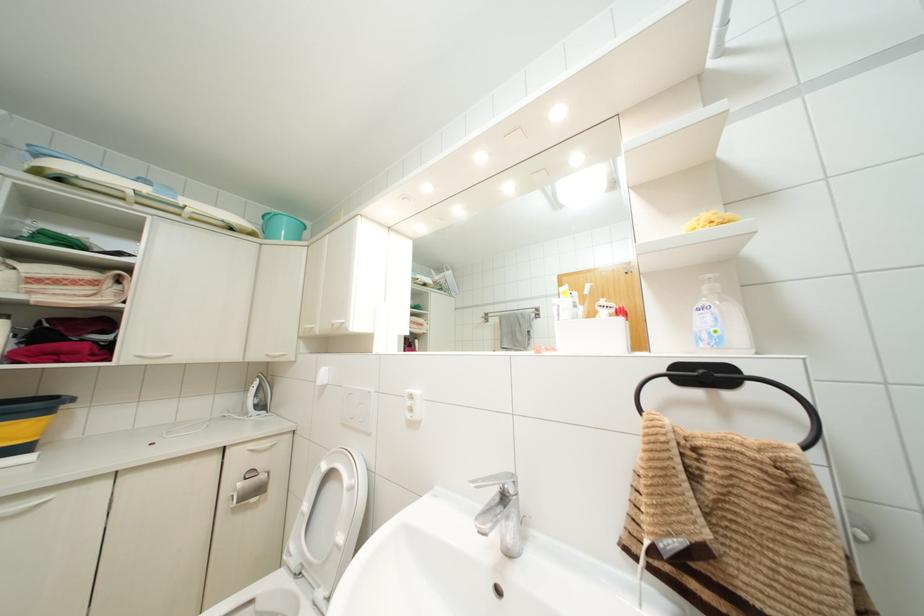
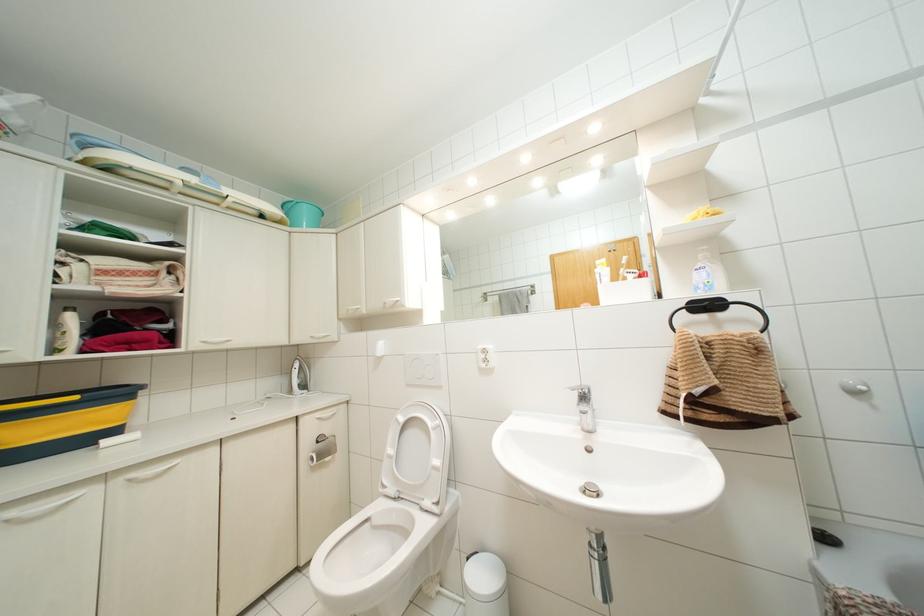
Question: The images are taken continuously from a first-person perspective. In which direction is your viewpoint rotating?

Choices:
 (A) Left
 (B) Right
 (C) Up
 (D) Down

Answer: (B)